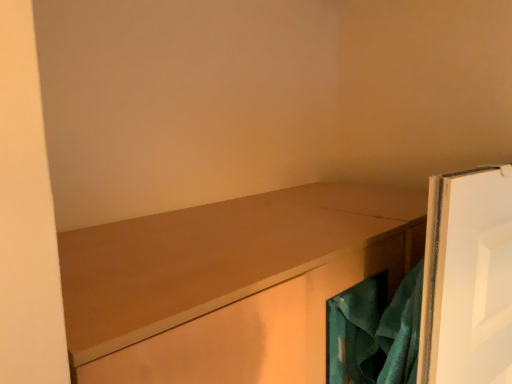
Locate an element on the screen. matte wood cabinet at center is located at coordinates (230, 283).

This screenshot has width=512, height=384. What do you see at coordinates (230, 283) in the screenshot?
I see `matte wood cabinet at center` at bounding box center [230, 283].

Find the location of `teal fabric at right`. teal fabric at right is located at coordinates (375, 333).

What do you see at coordinates (375, 333) in the screenshot? This screenshot has height=384, width=512. I see `teal fabric at right` at bounding box center [375, 333].

Locate an element on the screen. matte wood cabinet at center is located at coordinates (230, 283).

Is teal fabric at right to the right of matte wood cabinet at center from the viewer's perspective?

Indeed, teal fabric at right is positioned on the right side of matte wood cabinet at center.

Who is more distant, teal fabric at right or matte wood cabinet at center?

teal fabric at right is further away from the camera.

Which is in front, point (327, 355) or point (180, 294)?

Positioned in front is point (180, 294).

From the image's perspective, is teal fabric at right located above matte wood cabinet at center?

Indeed, from the image's perspective, teal fabric at right is shown above matte wood cabinet at center.

Based on the photo, from a real-world perspective, is teal fabric at right over matte wood cabinet at center?

Correct, in the physical world, teal fabric at right is higher than matte wood cabinet at center.

Between teal fabric at right and matte wood cabinet at center, which one has smaller width?

teal fabric at right.

Considering the sizes of teal fabric at right and matte wood cabinet at center in the image, is teal fabric at right taller or shorter than matte wood cabinet at center?

teal fabric at right is shorter than matte wood cabinet at center.

Is teal fabric at right bigger than matte wood cabinet at center?

Incorrect, teal fabric at right is not larger than matte wood cabinet at center.

Is teal fabric at right outside of matte wood cabinet at center?

That's correct, teal fabric at right is outside of matte wood cabinet at center.

Are teal fabric at right and matte wood cabinet at center beside each other?

teal fabric at right and matte wood cabinet at center are clearly separated.

Is teal fabric at right turned away from matte wood cabinet at center?

Yes, teal fabric at right is facing away from matte wood cabinet at center.

Measure the distance between teal fabric at right and matte wood cabinet at center.

8.53 inches.

I want to click on cabinetry lying below the teal fabric at right (from the image's perspective), so point(230,283).

Which object is positioned more to the left, matte wood cabinet at center or teal fabric at right?

matte wood cabinet at center.

Based on the photo, which object is closer to the camera taking this photo, matte wood cabinet at center or teal fabric at right?

Positioned in front is matte wood cabinet at center.

Is point (222, 318) more distant than point (338, 372)?

No, (222, 318) is in front of (338, 372).

From the image's perspective, which one is positioned lower, matte wood cabinet at center or teal fabric at right?

matte wood cabinet at center appears lower in the image.

From a real-world perspective, between matte wood cabinet at center and teal fabric at right, who is vertically higher?

teal fabric at right is physically above.

Can you confirm if matte wood cabinet at center is thinner than teal fabric at right?

In fact, matte wood cabinet at center might be wider than teal fabric at right.

Considering the relative sizes of matte wood cabinet at center and teal fabric at right in the image provided, is matte wood cabinet at center taller than teal fabric at right?

Indeed, matte wood cabinet at center has a greater height compared to teal fabric at right.

Looking at the image, does matte wood cabinet at center seem bigger or smaller compared to teal fabric at right?

In the image, matte wood cabinet at center appears to be larger than teal fabric at right.

Is matte wood cabinet at center spatially inside teal fabric at right, or outside of it?

matte wood cabinet at center is spatially situated outside teal fabric at right.

Is matte wood cabinet at center far from teal fabric at right?

No, there isn't a large distance between matte wood cabinet at center and teal fabric at right.

Is matte wood cabinet at center turned away from teal fabric at right?

No.

Locate an element on the screen. The height and width of the screenshot is (384, 512). laundry above the matte wood cabinet at center (from a real-world perspective) is located at coordinates (375, 333).

Locate an element on the screen. The width and height of the screenshot is (512, 384). laundry that appears behind the matte wood cabinet at center is located at coordinates (375, 333).

Where is `laundry on the right of matte wood cabinet at center`? This screenshot has width=512, height=384. laundry on the right of matte wood cabinet at center is located at coordinates (375, 333).